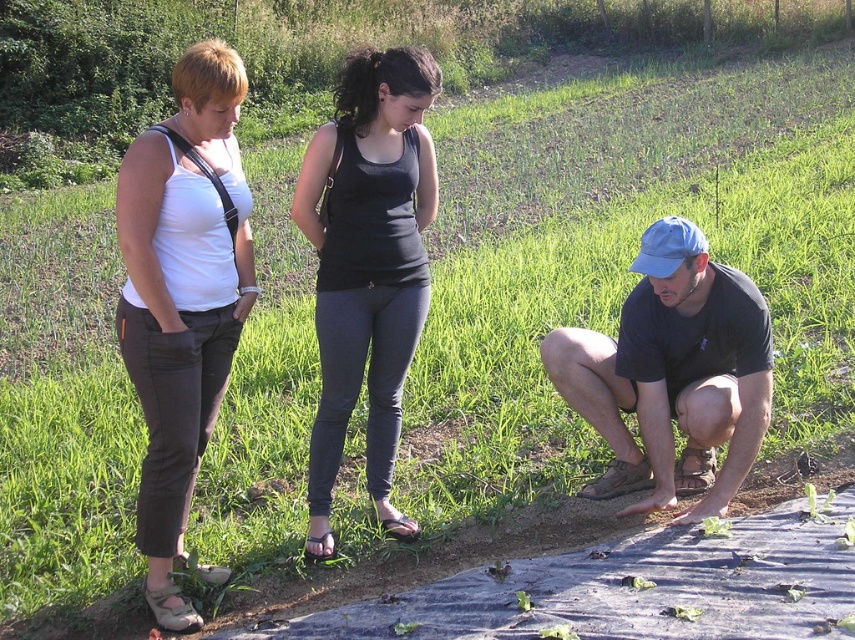
You are a photographer trying to capture a group photo of the matte white tank top at center and the blue cap at lower right. Which object should you focus on first if you want to include both in the frame without moving the camera?

You should focus on the blue cap at lower right first because it has a greater width than the matte white tank top at center, allowing it to fill the frame better while still including the smaller object.

You are a fashion designer observing two women in the center of a grassy field. Both are wearing tank tops. The first woman has a matte white tank top at center, and the second has a black matte tank top at center. Which tank top has a greater width?

The matte white tank top at center has a greater width than the black matte tank top at center according to the description.

Based on the photo, based on the scene description, where is the matte white tank top at center located in terms of its 2D coordinates?

The matte white tank top at center is located at the 2D coordinates point (181, 298).